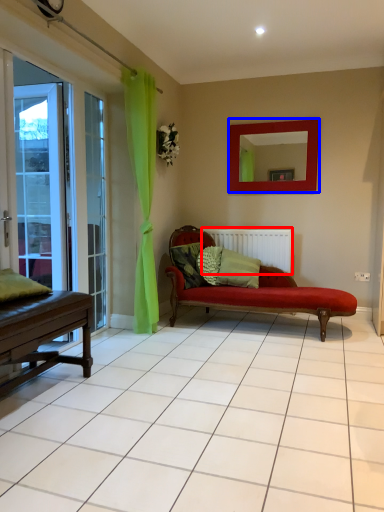
Question: Which of the following is the closest to the observer, radiator (highlighted by a red box) or mirror (highlighted by a blue box)?

Choices:
 (A) radiator
 (B) mirror

Answer: (B)